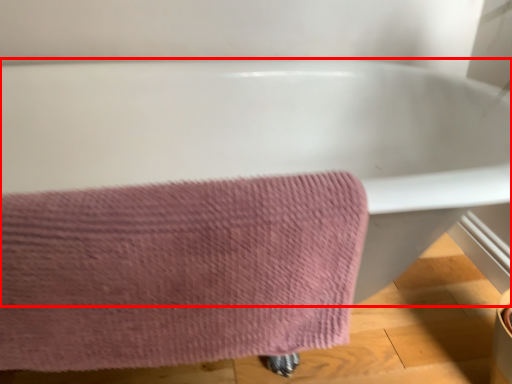
Question: From the image's perspective, where is bathtub (annotated by the red box) located relative to towel?

Choices:
 (A) above
 (B) below

Answer: (A)